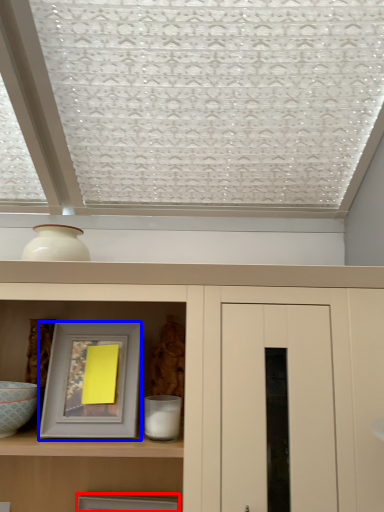
Question: Which object is further to the camera taking this photo, picture frame (highlighted by a red box) or picture frame (highlighted by a blue box)?

Choices:
 (A) picture frame
 (B) picture frame

Answer: (A)